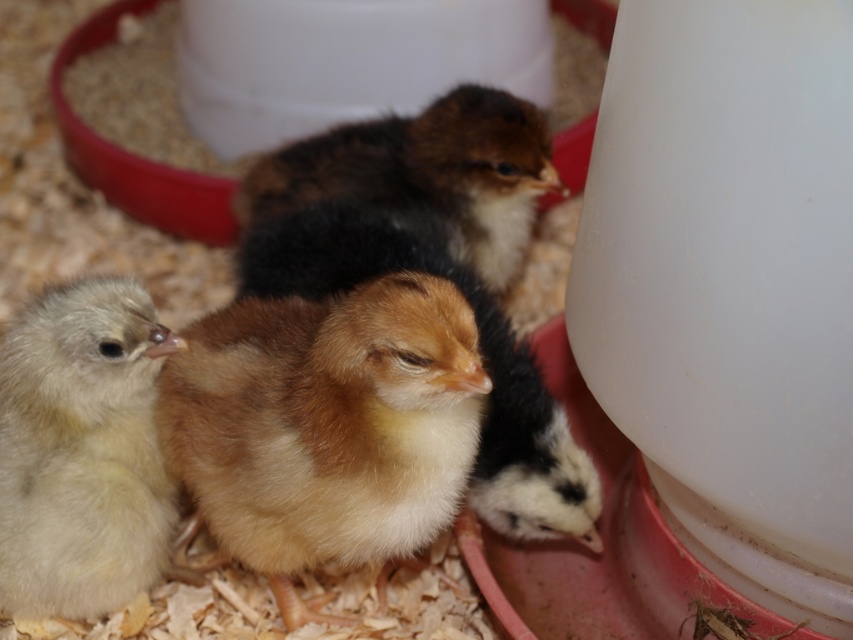
Between fluffy yellow chick at center and golden fluffy chick at center, which one appears on the left side from the viewer's perspective?

Positioned to the left is fluffy yellow chick at center.

This screenshot has width=853, height=640. I want to click on fluffy yellow chick at center, so click(x=325, y=424).

Between point (416, 371) and point (538, 499), which one is positioned behind?

The point (538, 499) is more distant.

The height and width of the screenshot is (640, 853). I want to click on fluffy yellow chick at center, so click(x=325, y=424).

Can you confirm if fluffy yellow chick at center is positioned to the right of light yellow fluffy chick at lower left?

Indeed, fluffy yellow chick at center is positioned on the right side of light yellow fluffy chick at lower left.

Can you confirm if fluffy yellow chick at center is positioned to the left of light yellow fluffy chick at lower left?

Incorrect, fluffy yellow chick at center is not on the left side of light yellow fluffy chick at lower left.

Locate an element on the screen. This screenshot has height=640, width=853. fluffy yellow chick at center is located at coordinates (325, 424).

Based on the photo, does light yellow fluffy chick at lower left have a greater width compared to brown fluffy chick at center?

No, light yellow fluffy chick at lower left is not wider than brown fluffy chick at center.

Is point (83, 580) farther from camera compared to point (498, 266)?

That is False.

The image size is (853, 640). Describe the element at coordinates (82, 451) in the screenshot. I see `light yellow fluffy chick at lower left` at that location.

Locate an element on the screen. The width and height of the screenshot is (853, 640). light yellow fluffy chick at lower left is located at coordinates (82, 451).